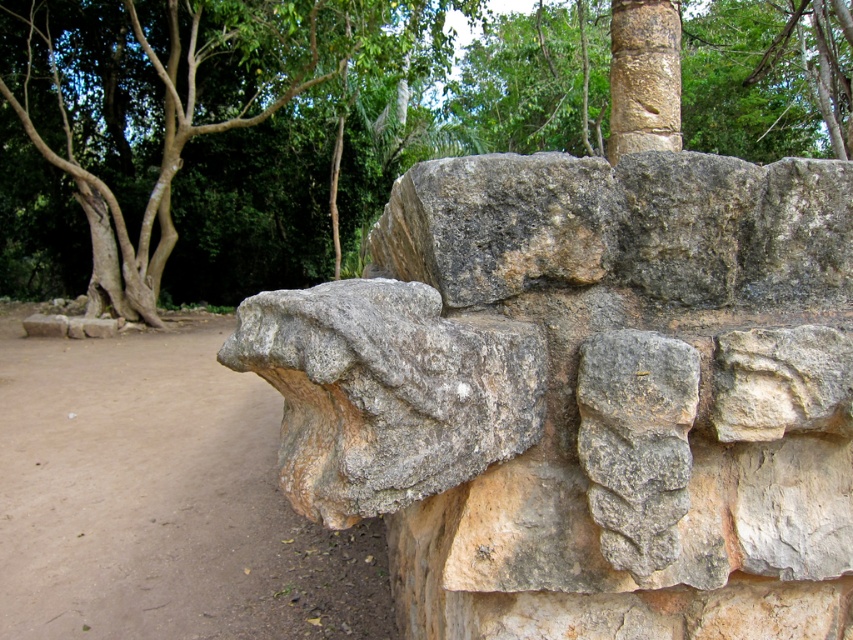
Question: Which is farther from the gray rough stone at center?

Choices:
 (A) brown dirt field at lower left
 (B) green leafy tree at upper center
 (C) gray stone wall at center
 (D) smooth brown stone column at upper center

Answer: (B)

Question: Observing the image, what is the correct spatial positioning of green leafy tree at upper center in reference to smooth brown stone column at upper center?

Choices:
 (A) right
 (B) left

Answer: (B)

Question: Can you confirm if gray rough stone at center is wider than smooth brown stone column at upper center?

Choices:
 (A) no
 (B) yes

Answer: (B)

Question: Which object is farther from the camera taking this photo?

Choices:
 (A) smooth brown stone column at upper center
 (B) gray rough stone at center
 (C) gray stone wall at center
 (D) green leafy tree at upper center

Answer: (A)

Question: In this image, where is gray stone wall at center located relative to green leafy tree at upper center?

Choices:
 (A) right
 (B) left

Answer: (A)

Question: Which object appears closest to the camera in this image?

Choices:
 (A) green leafy tree at upper center
 (B) smooth brown stone column at upper center

Answer: (A)